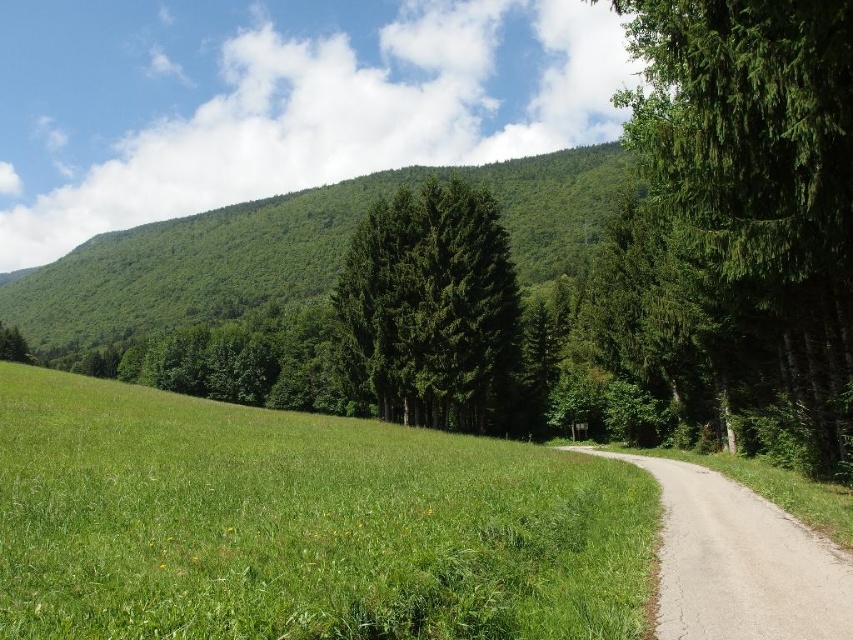
You are standing at the point marked as point (x=293, y=250) in the image. Looking around, you notice the green leafy hillside at upper left. Based on your position, which direction would the green leafy hillside at upper left be relative to you?

The green leafy hillside at upper left is located at point (x=293, y=250), so if you are standing at that point, the green leafy hillside at upper left would be directly behind you.

You are standing at the center of the image and want to walk towards the green textured tree at right. Which direction should you face to head directly towards it?

Since the green textured tree at right is located at point 0.303 on the x axis and 0.887 on the y axis, you should face towards the right and slightly upwards to head directly towards it.